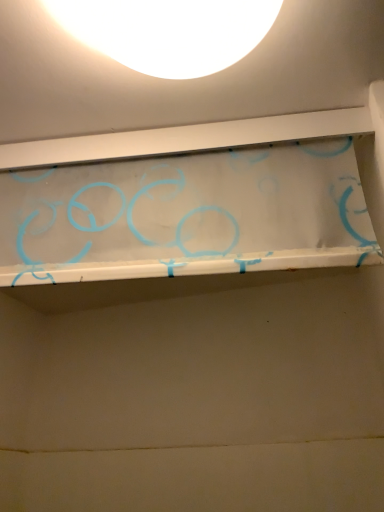
Locate an element on the screen. This screenshot has width=384, height=512. free point above transparent plastic shelf at upper center (from a real-world perspective) is located at coordinates (155, 155).